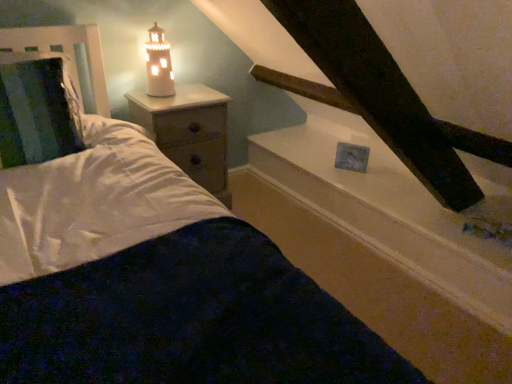
Where is `wooden nightstand at left`? wooden nightstand at left is located at coordinates (189, 132).

Where is `white soft bedding at center`? The image size is (512, 384). white soft bedding at center is located at coordinates (189, 319).

I want to click on white ceramic lighthouse at upper left, so click(159, 64).

Identify the location of white glossy window sill at upper center. The height and width of the screenshot is (384, 512). (387, 212).

Identify the location of wooden nightstand at left. The image size is (512, 384). (189, 132).

Does white ceramic lighthouse at upper left have a lesser width compared to white soft bedding at center?

Indeed, white ceramic lighthouse at upper left has a lesser width compared to white soft bedding at center.

Is white ceramic lighthouse at upper left situated inside white soft bedding at center or outside?

white ceramic lighthouse at upper left is not inside white soft bedding at center, it's outside.

Considering the positions of objects white ceramic lighthouse at upper left and white soft bedding at center in the image provided, who is more to the left, white ceramic lighthouse at upper left or white soft bedding at center?

From the viewer's perspective, white ceramic lighthouse at upper left appears more on the left side.

Considering their positions, is white glossy window sill at upper center located in front of or behind white soft bedding at center?

In the image, white glossy window sill at upper center appears behind white soft bedding at center.

Is white glossy window sill at upper center turned away from white soft bedding at center?

That's not correct — white glossy window sill at upper center is not looking away from white soft bedding at center.

Identify the location of bedding on the left of white glossy window sill at upper center. (189, 319).

Is point (57, 45) farther from viewer compared to point (349, 360)?

Yes, point (57, 45) is behind point (349, 360).

Could you tell me if metallic silver headboard at left is facing white soft bedding at center?

No.

Is metallic silver headboard at left bigger than white soft bedding at center?

No, metallic silver headboard at left is not bigger than white soft bedding at center.

From the image's perspective, does metallic silver headboard at left appear lower than white soft bedding at center?

No, from the image's perspective, metallic silver headboard at left is not below white soft bedding at center.

From the picture: Is metallic silver headboard at left facing towards white ceramic lighthouse at upper left?

No, metallic silver headboard at left does not turn towards white ceramic lighthouse at upper left.

From a real-world perspective, is metallic silver headboard at left located higher than white ceramic lighthouse at upper left?

No, from a real-world perspective, metallic silver headboard at left is not above white ceramic lighthouse at upper left.

Which object is more forward, metallic silver headboard at left or white ceramic lighthouse at upper left?

metallic silver headboard at left is closer to the camera.

Is metallic silver headboard at left oriented away from white glossy window sill at upper center?

That's not correct — metallic silver headboard at left is not looking away from white glossy window sill at upper center.

In the scene shown: Does metallic silver headboard at left appear on the right side of white glossy window sill at upper center?

In fact, metallic silver headboard at left is to the left of white glossy window sill at upper center.

Is metallic silver headboard at left inside or outside of white glossy window sill at upper center?

metallic silver headboard at left lies outside white glossy window sill at upper center.

What's the angular difference between metallic silver headboard at left and white glossy window sill at upper center's facing directions?

The angular difference between metallic silver headboard at left and white glossy window sill at upper center is 3.92 degrees.

Is white ceramic lighthouse at upper left further to camera compared to metallic silver headboard at left?

Yes, it is behind metallic silver headboard at left.

This screenshot has height=384, width=512. In order to click on headboard below the white ceramic lighthouse at upper left (from a real-world perspective) in this screenshot , I will do `click(68, 57)`.

Based on their positions, is white ceramic lighthouse at upper left located to the left or right of metallic silver headboard at left?

Clearly, white ceramic lighthouse at upper left is on the right of metallic silver headboard at left in the image.

What's the angular difference between white ceramic lighthouse at upper left and metallic silver headboard at left's facing directions?

They differ by 96.6 degrees in their facing directions.

How many degrees apart are the facing directions of white soft bedding at center and white ceramic lighthouse at upper left?

The angle between the facing direction of white soft bedding at center and the facing direction of white ceramic lighthouse at upper left is 93.5 degrees.

From the image's perspective, is white soft bedding at center on white ceramic lighthouse at upper left?

Incorrect, from the image's perspective, white soft bedding at center is lower than white ceramic lighthouse at upper left.

Does white soft bedding at center have a lesser width compared to white ceramic lighthouse at upper left?

No, white soft bedding at center is not thinner than white ceramic lighthouse at upper left.

Is white ceramic lighthouse at upper left completely or partially inside white soft bedding at center?

No, white ceramic lighthouse at upper left is not a part of white soft bedding at center.

Locate an element on the screen. bedding in front of the white ceramic lighthouse at upper left is located at coordinates (189, 319).

You are a GUI agent. You are given a task and a screenshot of the screen. Output one action in this format:
    pyautogui.click(x=<x>, y=<y>)
    Task: Click on the window sill behind the white soft bedding at center
    The image size is (512, 384).
    Given the screenshot: What is the action you would take?
    pyautogui.click(x=387, y=212)

In the scene shown: Which object lies further to the anchor point white glossy window sill at upper center, white soft bedding at center or white ceramic lighthouse at upper left?

white soft bedding at center is positioned further to the anchor white glossy window sill at upper center.

Considering their positions, is wooden nightstand at left positioned further to white ceramic lighthouse at upper left than white glossy window sill at upper center?

white glossy window sill at upper center lies further to white ceramic lighthouse at upper left than the other object.

From the image, which object appears to be nearer to metallic silver headboard at left, white glossy window sill at upper center or white soft bedding at center?

white glossy window sill at upper center is closer to metallic silver headboard at left.

Looking at the image, which one is located closer to white ceramic lighthouse at upper left, white glossy window sill at upper center or white soft bedding at center?

Based on the image, white glossy window sill at upper center appears to be nearer to white ceramic lighthouse at upper left.

Estimate the real-world distances between objects in this image. Which object is further from white glossy window sill at upper center, metallic silver headboard at left or white soft bedding at center?

Based on the image, metallic silver headboard at left appears to be further to white glossy window sill at upper center.

Which object lies nearer to the anchor point white soft bedding at center, white ceramic lighthouse at upper left or white glossy window sill at upper center?

Among the two, white glossy window sill at upper center is located nearer to white soft bedding at center.

Considering their positions, is white glossy window sill at upper center positioned further to metallic silver headboard at left than wooden nightstand at left?

Based on the image, white glossy window sill at upper center appears to be further to metallic silver headboard at left.

From the image, which object appears to be farther from white soft bedding at center, metallic silver headboard at left or white ceramic lighthouse at upper left?

white ceramic lighthouse at upper left is positioned further to the anchor white soft bedding at center.

The height and width of the screenshot is (384, 512). I want to click on nightstand between white ceramic lighthouse at upper left and white glossy window sill at upper center from left to right, so click(x=189, y=132).

Image resolution: width=512 pixels, height=384 pixels. Identify the location of headboard between white soft bedding at center and white ceramic lighthouse at upper left along the z-axis. (68, 57).

Locate an element on the screen. The image size is (512, 384). headboard located between white soft bedding at center and wooden nightstand at left in the depth direction is located at coordinates (68, 57).

I want to click on lamp located between metallic silver headboard at left and white glossy window sill at upper center in the left-right direction, so click(x=159, y=64).